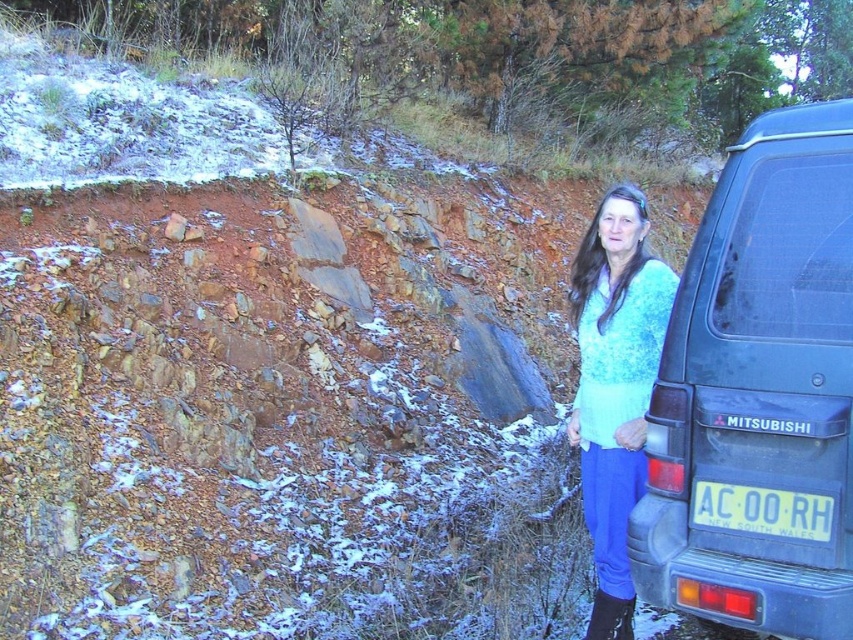
From the picture: Does matte blue suv at right appear on the left side of yellow plastic license plate at lower right?

Incorrect, matte blue suv at right is not on the left side of yellow plastic license plate at lower right.

Who is taller, matte blue suv at right or yellow plastic license plate at lower right?

matte blue suv at right is taller.

The width and height of the screenshot is (853, 640). Identify the location of matte blue suv at right. (759, 394).

Which is below, matte blue suv at right or light blue knitted sweater at center?

light blue knitted sweater at center

Is point (776, 257) closer to viewer compared to point (628, 449)?

Yes, it is.

Measure the distance between point [825,419] and camera.

Point [825,419] and camera are 7.49 feet apart from each other.

Where is `matte blue suv at right`? The width and height of the screenshot is (853, 640). matte blue suv at right is located at coordinates (759, 394).

Is light blue knitted sweater at center thinner than yellow plastic license plate at lower right?

No.

Identify the location of light blue knitted sweater at center. (614, 387).

Who is more forward, (645, 385) or (747, 516)?

Point (747, 516) is more forward.

Where is `light blue knitted sweater at center`? light blue knitted sweater at center is located at coordinates (614, 387).